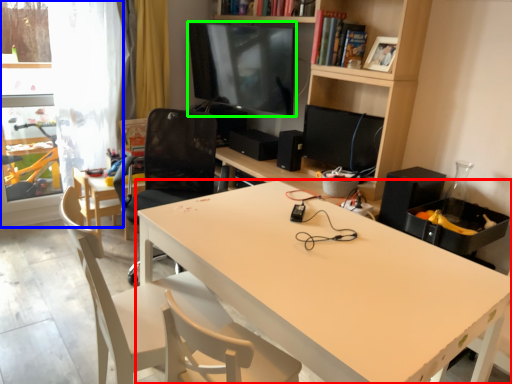
Question: Which is farther away from desk (highlighted by a red box)? glass door (highlighted by a blue box) or television (highlighted by a green box)?

Choices:
 (A) glass door
 (B) television

Answer: (A)